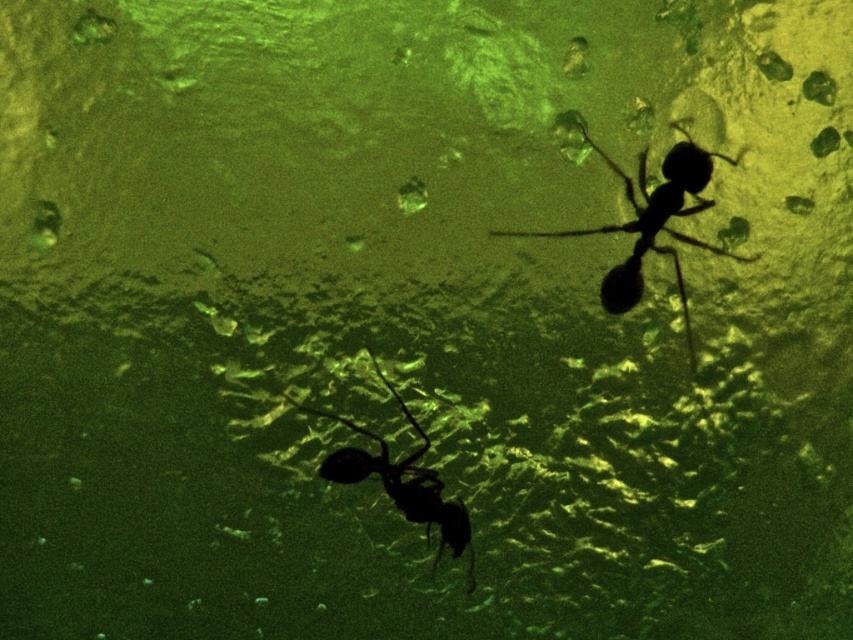
You are observing two ants in a dark, greenish environment. You notice a black matte ant at upper right and a black matte ant at lower center. Which ant is positioned more to the east in this scene?

The black matte ant at upper right is positioned more to the east because it is to the right of the black matte ant at lower center, and in such scenes, right typically corresponds to east.

You are a tiny explorer who needs to cross the surface where the black matte ant at upper right and the black matte ant at lower center are moving. Which ant is closer to the top edge of the surface?

The black matte ant at upper right is closer to the top edge of the surface because it is positioned higher up than the black matte ant at lower center.

You are a tiny explorer who needs to travel from the black matte ant at upper right to the black matte ant at lower center. Given that your maximum travel distance is 30 centimeters, will you be able to make the journey without exceeding your limit?

The distance between the black matte ant at upper right and the black matte ant at lower center is 29.16 centimeters, which is under your 30 centimeter limit. Yes, you can make the journey without exceeding your travel distance limit.